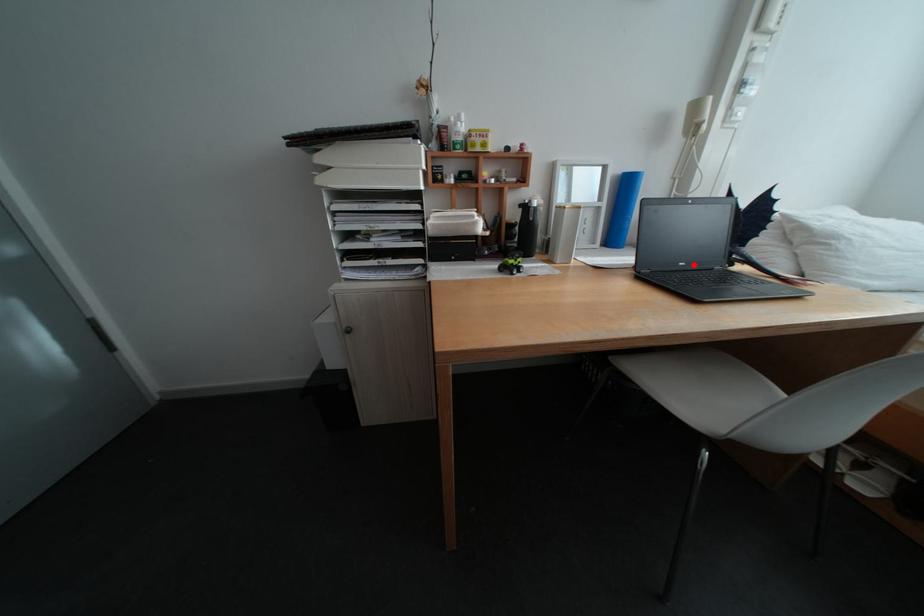
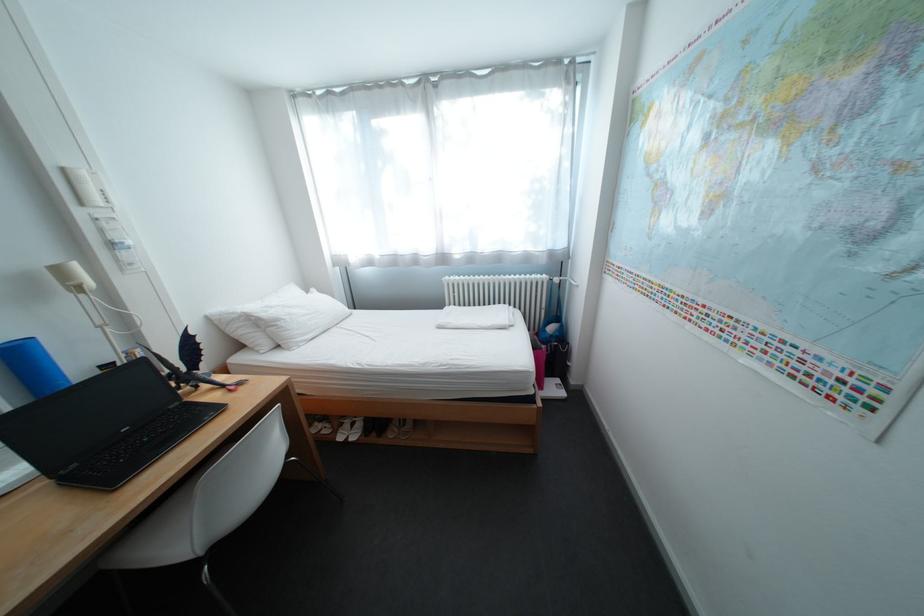
The point at the highlighted location is marked in the first image. Where is the corresponding point in the second image?

(137, 431)